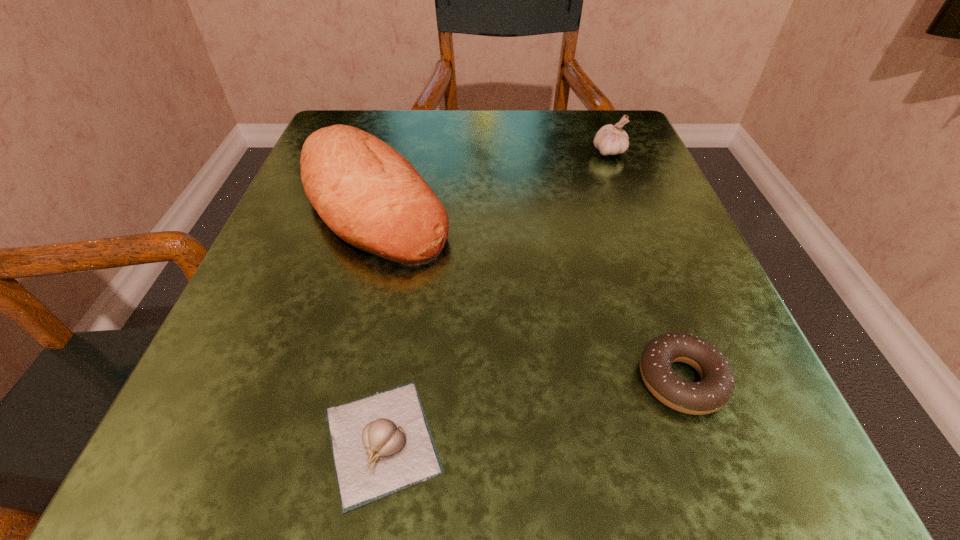
You are a GUI agent. You are given a task and a screenshot of the screen. Output one action in this format:
    pyautogui.click(x=<x>, y=<y>)
    Task: Click on the vacant space that satisfies the following two spatial constraints: 1. on the back side of the doughnut; 2. on the right side of the taller garlic
    The width and height of the screenshot is (960, 540).
    Given the screenshot: What is the action you would take?
    pyautogui.click(x=599, y=152)